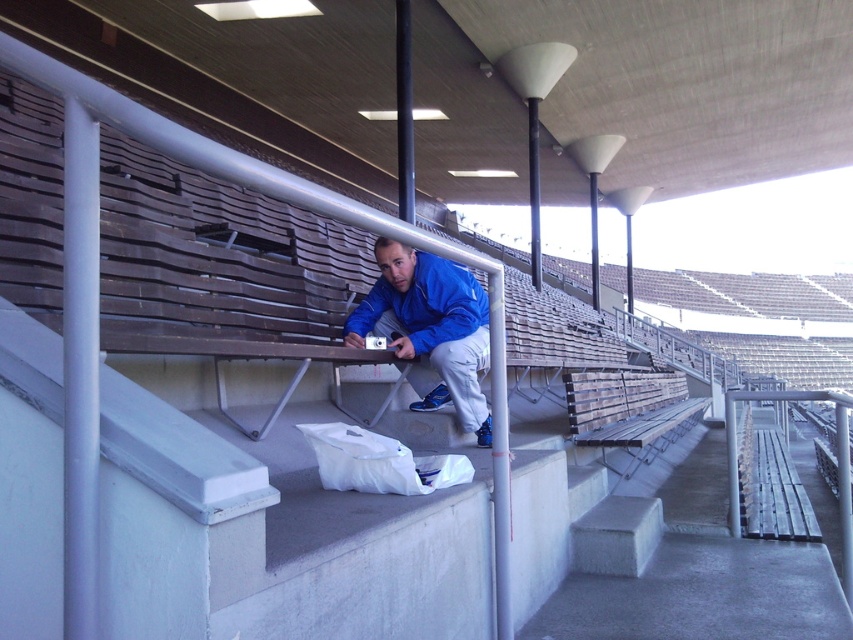
What do you see at coordinates (428, 330) in the screenshot?
I see `blue fabric jacket at center` at bounding box center [428, 330].

Which is behind, point (456, 392) or point (567, 387)?

Positioned behind is point (567, 387).

Image resolution: width=853 pixels, height=640 pixels. What are the coordinates of `blue fabric jacket at center` in the screenshot? It's located at (428, 330).